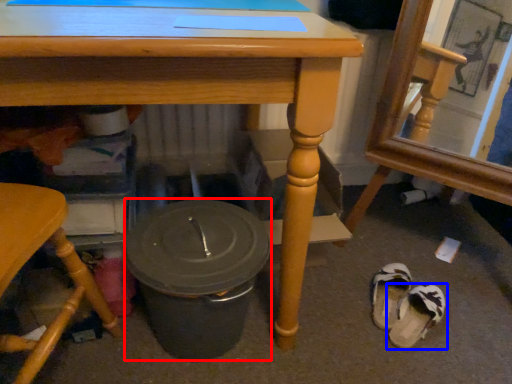
Question: Which object appears closest to the camera in this image, crock pot (highlighted by a red box) or footwear (highlighted by a blue box)?

Choices:
 (A) crock pot
 (B) footwear

Answer: (A)